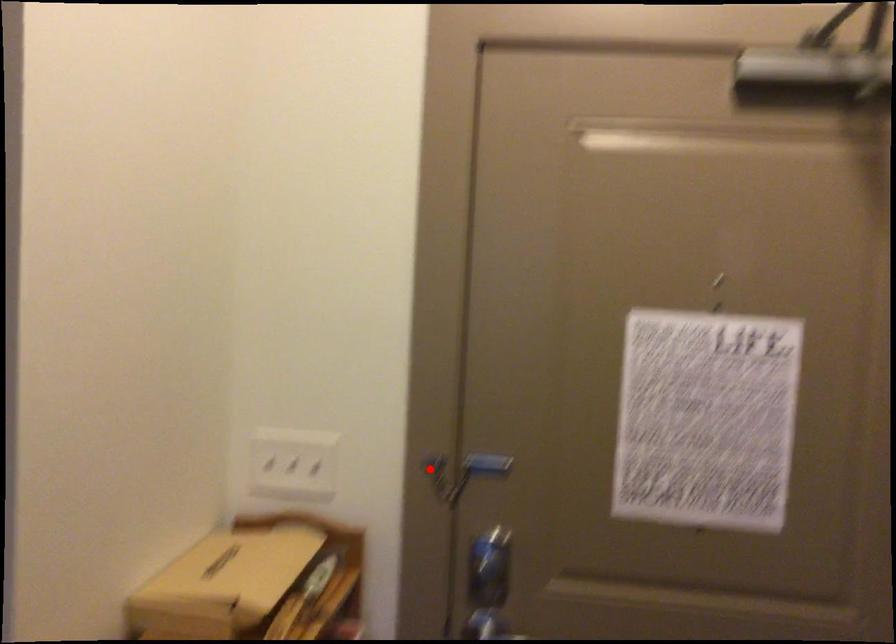
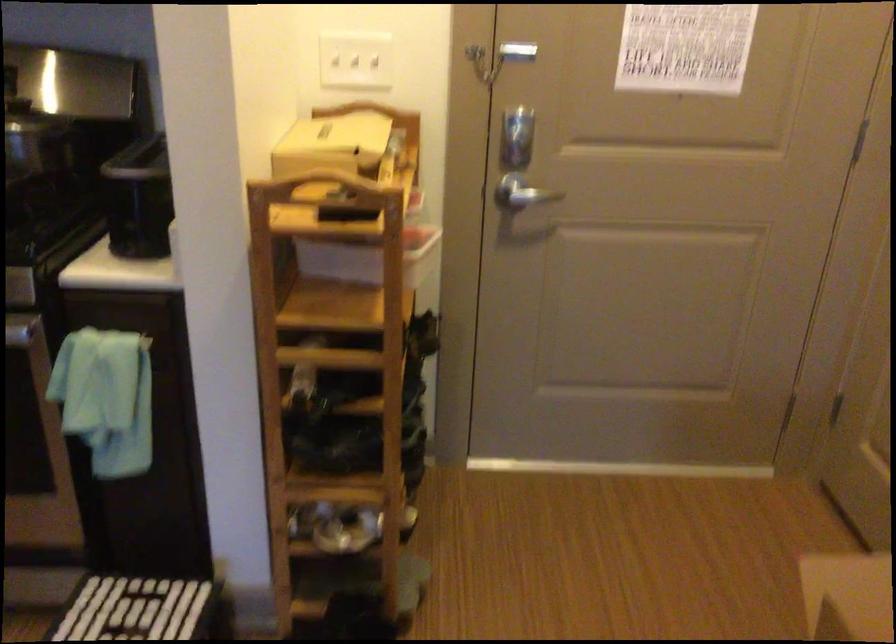
Locate, in the second image, the point that corresponds to the highlighted location in the first image.

(478, 57)